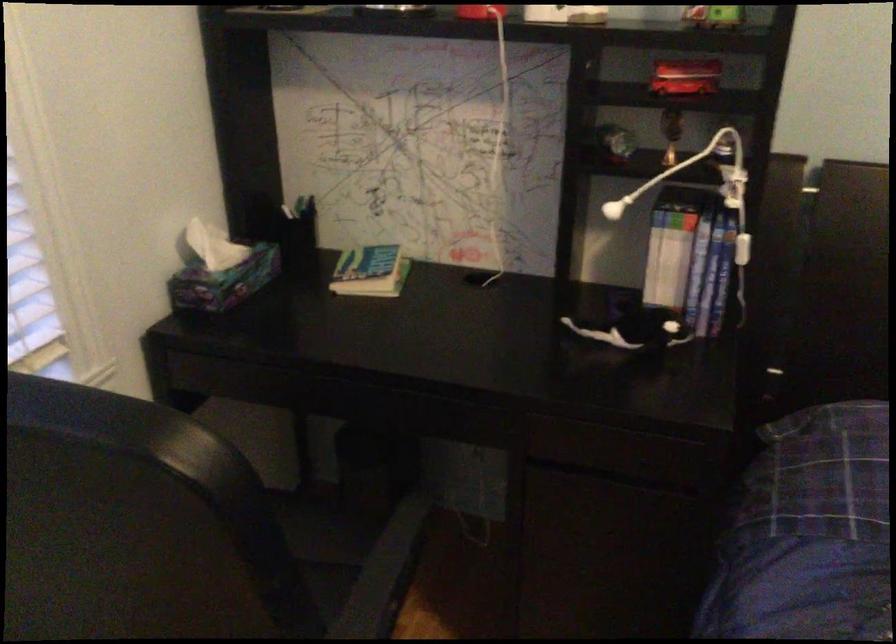
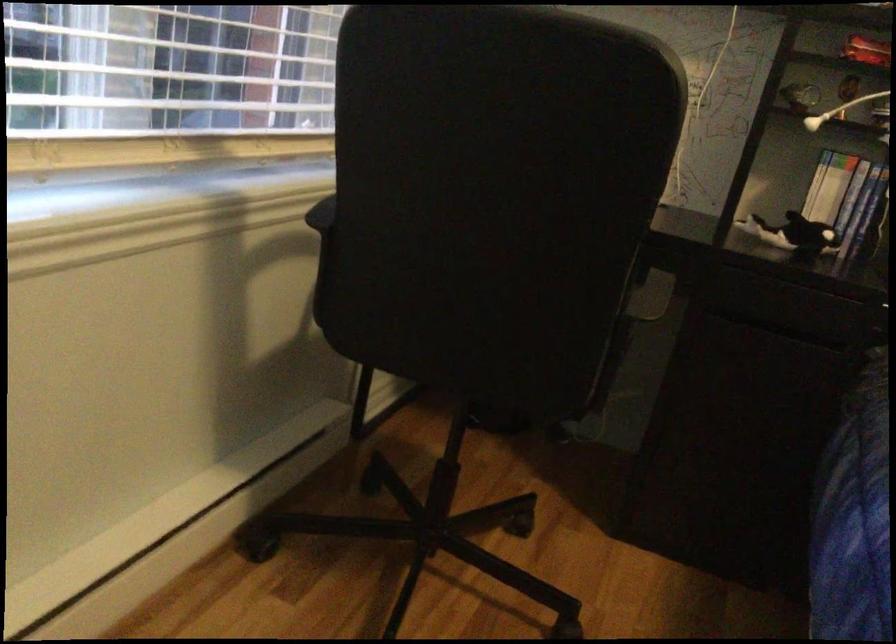
Question: I am providing you with two images of the same scene from different viewpoints. Which of the following objects are not visible in image2?

Choices:
 (A) white paper tissue
 (B) printer output tray
 (C) blue book spine
 (D) black chair armrest

Answer: (A)